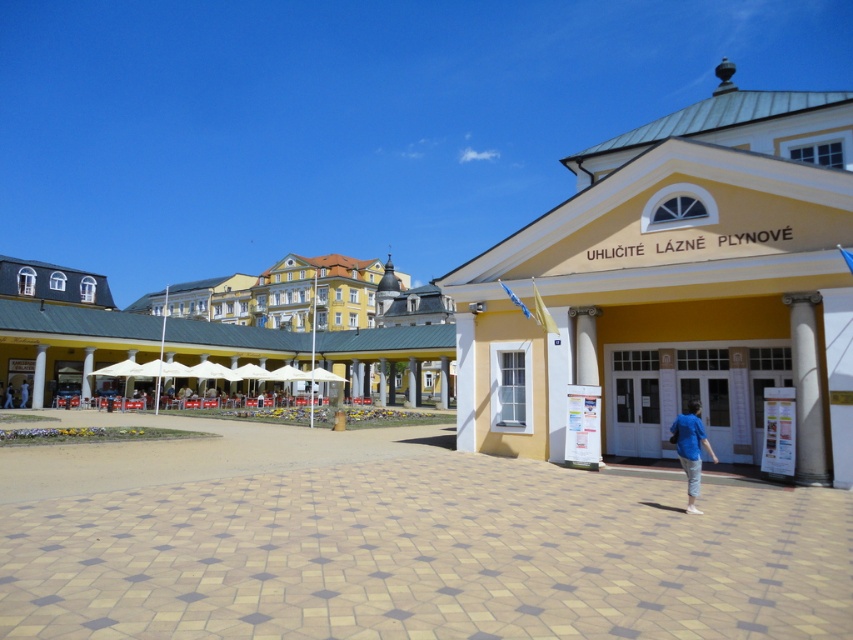
Which is above, blue cotton shirt at center or light blue shirt at lower left?

blue cotton shirt at center is above.

This screenshot has height=640, width=853. In order to click on blue cotton shirt at center in this screenshot , I will do `click(689, 449)`.

The width and height of the screenshot is (853, 640). What do you see at coordinates (689, 449) in the screenshot?
I see `blue cotton shirt at center` at bounding box center [689, 449].

I want to click on blue cotton shirt at center, so click(689, 449).

Who is positioned more to the left, white marble column at right or blue cotton shirt at center?

From the viewer's perspective, blue cotton shirt at center appears more on the left side.

Does white marble column at right have a lesser width compared to blue cotton shirt at center?

In fact, white marble column at right might be wider than blue cotton shirt at center.

Between point (805, 371) and point (712, 452), which one is positioned in front?

Point (805, 371) is in front.

In order to click on white marble column at right in this screenshot , I will do `click(805, 388)`.

Is white marble column at right smaller than light blue shirt at lower left?

Actually, white marble column at right might be larger than light blue shirt at lower left.

Where is `white marble column at right`? white marble column at right is located at coordinates (805, 388).